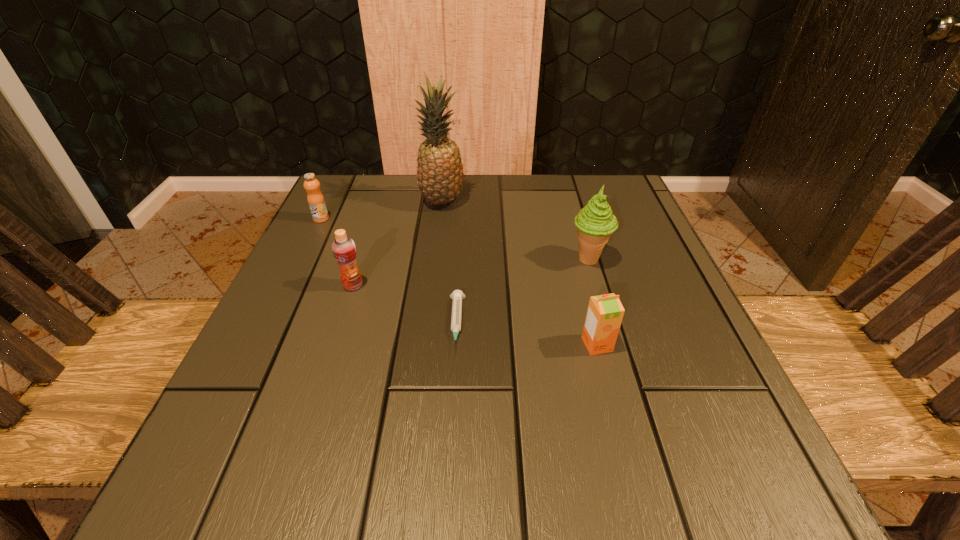
You are a GUI agent. You are given a task and a screenshot of the screen. Output one action in this format:
    pyautogui.click(x=<x>, y=<y>)
    Task: Click on the vacant area at the far edge
    
    Given the screenshot: What is the action you would take?
    pyautogui.click(x=554, y=218)

Where is `blank space at the near edge of the desktop`? The width and height of the screenshot is (960, 540). blank space at the near edge of the desktop is located at coordinates (362, 492).

Locate an element on the screen. free point at the left edge is located at coordinates (305, 235).

Locate an element on the screen. This screenshot has height=540, width=960. vacant point at the right edge is located at coordinates (703, 373).

Locate an element on the screen. The width and height of the screenshot is (960, 540). free space at the far left corner is located at coordinates (368, 184).

This screenshot has height=540, width=960. In the image, there is a desktop. What are the coordinates of `free region at the near left corner` in the screenshot? It's located at (178, 503).

Locate an element on the screen. The image size is (960, 540). free space at the near right corner of the desktop is located at coordinates (668, 507).

Where is `free spot between the shortest object and the second nearest orange juice`? The image size is (960, 540). free spot between the shortest object and the second nearest orange juice is located at coordinates (405, 305).

Where is `free spot between the rightmost orange juice and the syringe`? The height and width of the screenshot is (540, 960). free spot between the rightmost orange juice and the syringe is located at coordinates (527, 334).

Identify the location of vacant area that lies between the second tallest object and the tallest object. (516, 231).